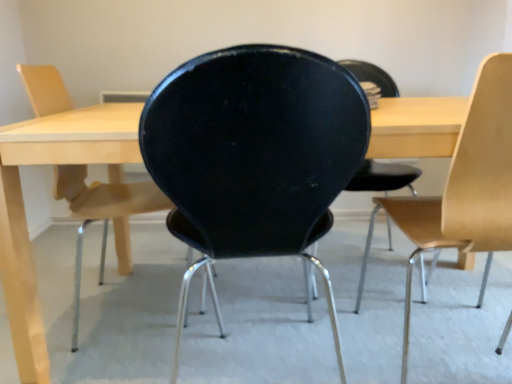
Question: Is point (298, 117) positioned closer to the camera than point (478, 112)?

Choices:
 (A) farther
 (B) closer

Answer: (B)

Question: Considering the relative positions of black matte chair at center, which ranks as the second chair in left-to-right order, and light wood/wooden chair at right, the first chair from the right, in the image provided, is black matte chair at center, which ranks as the second chair in left-to-right order, to the left or to the right of light wood/wooden chair at right, the first chair from the right,?

Choices:
 (A) left
 (B) right

Answer: (A)

Question: Estimate the real-world distances between objects in this image. Which object is farther from the matte black chair at center, marked as the third chair in a right-to-left arrangement?

Choices:
 (A) light wood/wooden chair at right, the 3th chair from the left
 (B) black matte chair at center, the second chair in the right-to-left sequence

Answer: (A)

Question: Estimate the real-world distances between objects in this image. Which object is farther from the black matte chair at center, which ranks as the second chair in left-to-right order?

Choices:
 (A) matte black chair at center, which appears as the 1th chair when viewed from the left
 (B) light wood/wooden chair at right, the 3th chair from the left

Answer: (A)